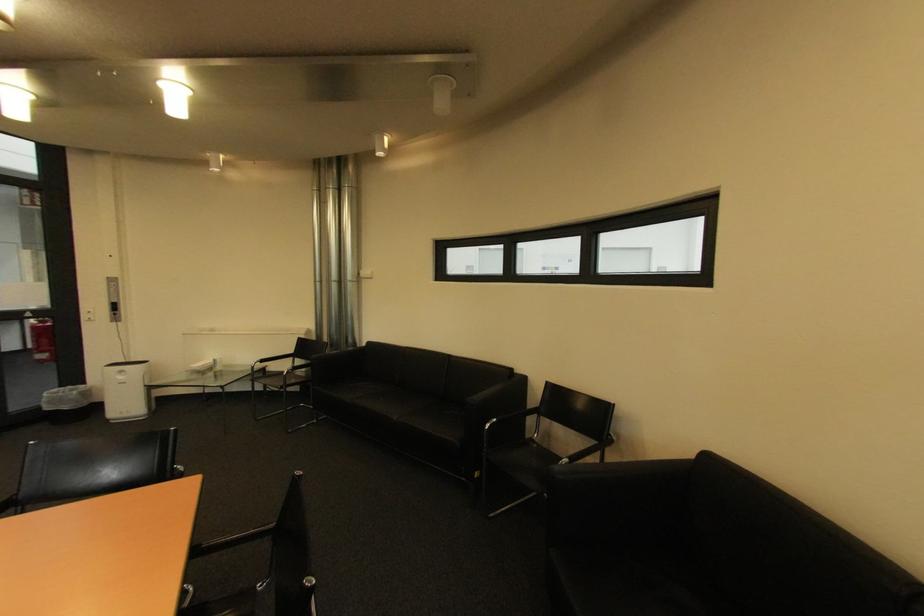
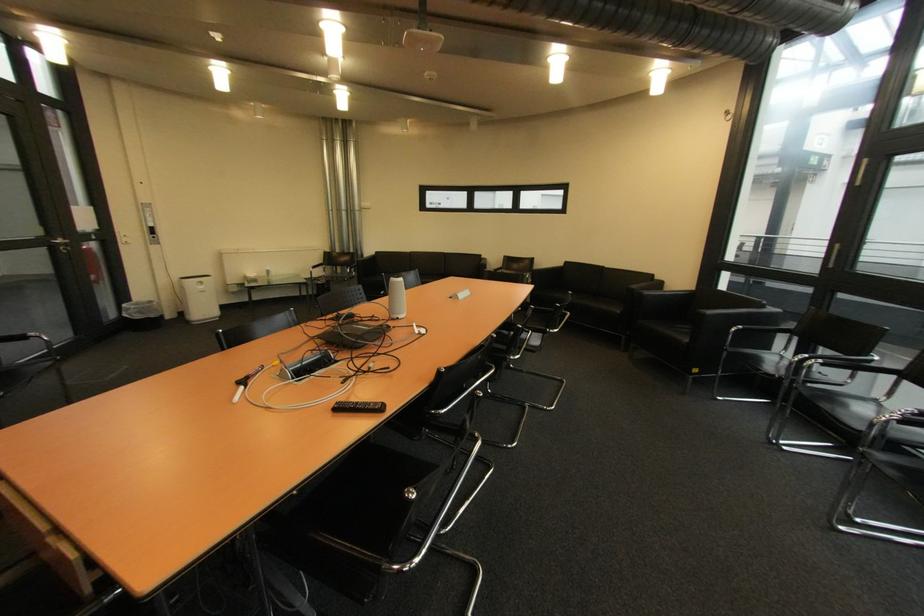
Where in the second image is the point corresponding to point (55, 410) from the first image?

(147, 318)